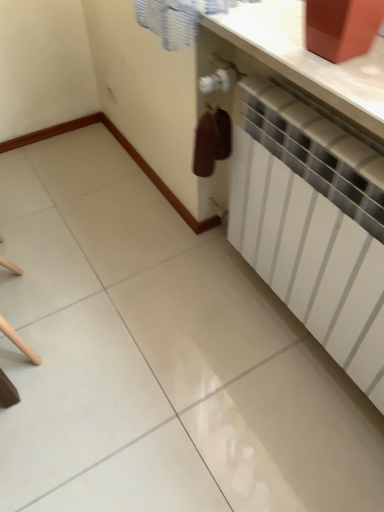
Question: Is white glossy counter top at upper right surrounded by white matte radiator at center?

Choices:
 (A) yes
 (B) no

Answer: (B)

Question: Can you confirm if white matte radiator at center is thinner than white glossy counter top at upper right?

Choices:
 (A) no
 (B) yes

Answer: (B)

Question: Does white matte radiator at center appear on the right side of white glossy counter top at upper right?

Choices:
 (A) no
 (B) yes

Answer: (B)

Question: From a real-world perspective, is white matte radiator at center on white glossy counter top at upper right?

Choices:
 (A) yes
 (B) no

Answer: (B)

Question: From the image's perspective, is white matte radiator at center on white glossy counter top at upper right?

Choices:
 (A) yes
 (B) no

Answer: (B)

Question: Considering the relative positions of white matte radiator at center and white glossy counter top at upper right in the image provided, is white matte radiator at center in front of white glossy counter top at upper right?

Choices:
 (A) no
 (B) yes

Answer: (B)

Question: Is white matte radiator at center a part of white glossy counter top at upper right?

Choices:
 (A) yes
 (B) no

Answer: (B)

Question: Can you confirm if white glossy counter top at upper right is positioned to the left of white matte radiator at center?

Choices:
 (A) no
 (B) yes

Answer: (B)

Question: From a real-world perspective, is white glossy counter top at upper right physically above white matte radiator at center?

Choices:
 (A) yes
 (B) no

Answer: (A)

Question: Is white glossy counter top at upper right turned away from white matte radiator at center?

Choices:
 (A) yes
 (B) no

Answer: (B)

Question: Is white glossy counter top at upper right oriented towards white matte radiator at center?

Choices:
 (A) yes
 (B) no

Answer: (B)

Question: Is the position of white glossy counter top at upper right less distant than that of white matte radiator at center?

Choices:
 (A) no
 (B) yes

Answer: (A)

Question: From a real-world perspective, is white matte radiator at center positioned above or below white glossy counter top at upper right?

Choices:
 (A) above
 (B) below

Answer: (B)